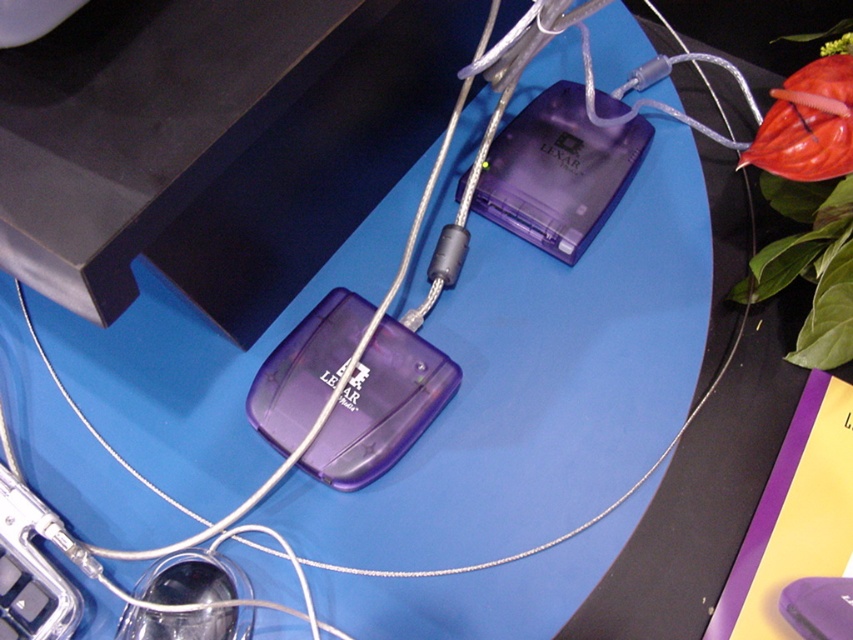
Question: Is transparent plastic lexar flash drive at center to the left of transparent plastic mouse at lower left from the viewer's perspective?

Choices:
 (A) yes
 (B) no

Answer: (B)

Question: Does transparent plastic lexar flash drive at center appear over transparent plastic mouse at lower left?

Choices:
 (A) no
 (B) yes

Answer: (B)

Question: Is transparent plastic lexar flash drive at center behind transparent plastic mouse at lower left?

Choices:
 (A) yes
 (B) no

Answer: (A)

Question: Among these points, which one is nearest to the camera?

Choices:
 (A) (549, 116)
 (B) (227, 593)

Answer: (B)